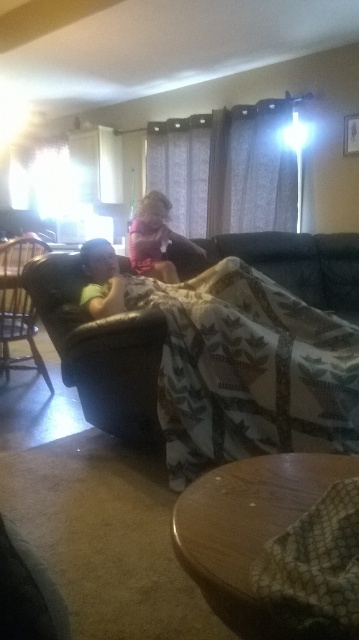
Question: Is brown quilted blanket at center positioned at the back of pink fabric at center?

Choices:
 (A) no
 (B) yes

Answer: (A)

Question: Which point is farther to the camera?

Choices:
 (A) (146, 230)
 (B) (5, 264)
 (C) (243, 403)

Answer: (A)

Question: Which object is the closest to the pink fabric at center?

Choices:
 (A) brown quilted blanket at center
 (B) dark brown leather armchair at left

Answer: (B)

Question: Is dark brown leather armchair at left further to the viewer compared to pink fabric at center?

Choices:
 (A) no
 (B) yes

Answer: (A)

Question: Does dark brown leather armchair at left have a larger size compared to pink fabric at center?

Choices:
 (A) yes
 (B) no

Answer: (A)

Question: Which of the following is the closest to the observer?

Choices:
 (A) 207,460
 (B) 152,236
 (C) 10,358

Answer: (A)